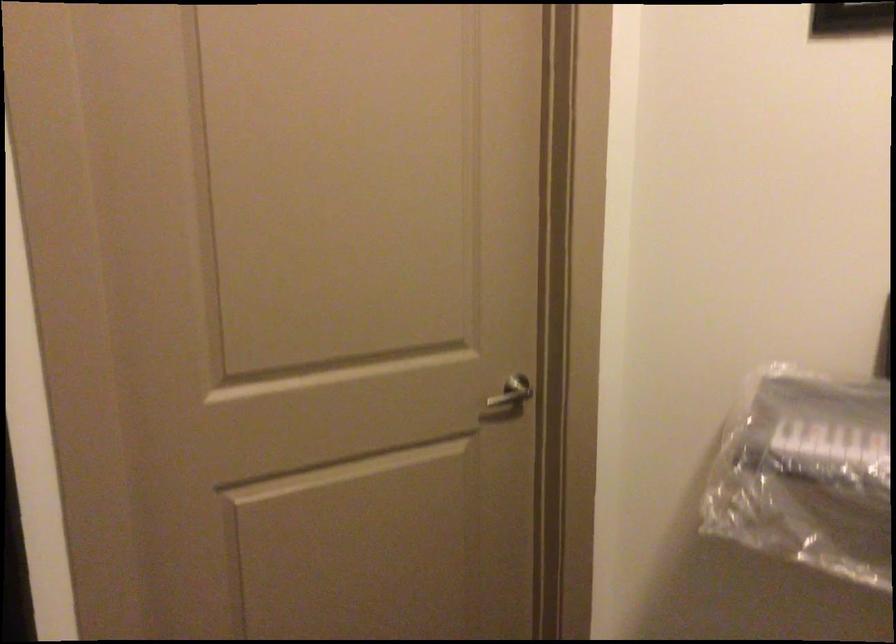
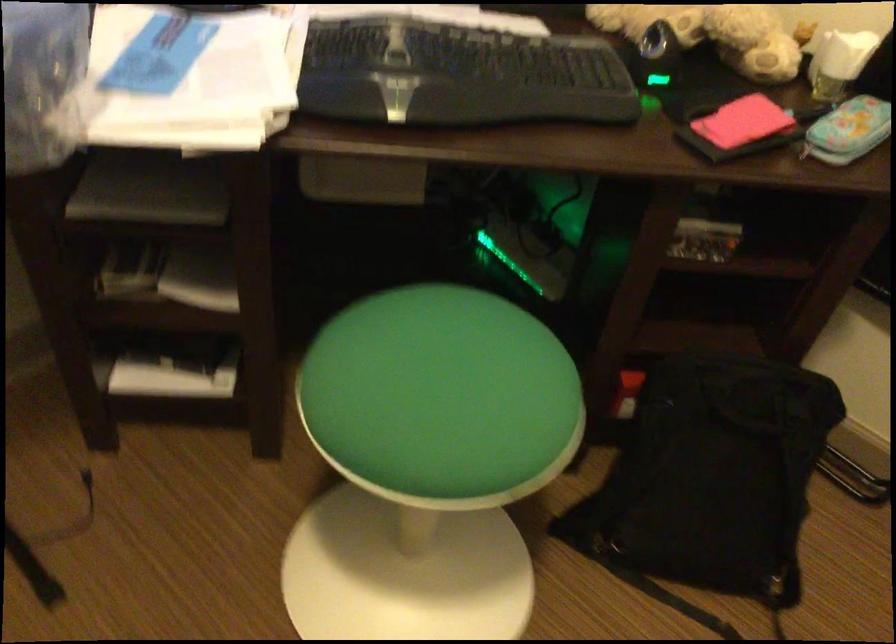
The images are taken continuously from a first-person perspective. In which direction is your viewpoint rotating?

The rotation direction of the camera is right-down.